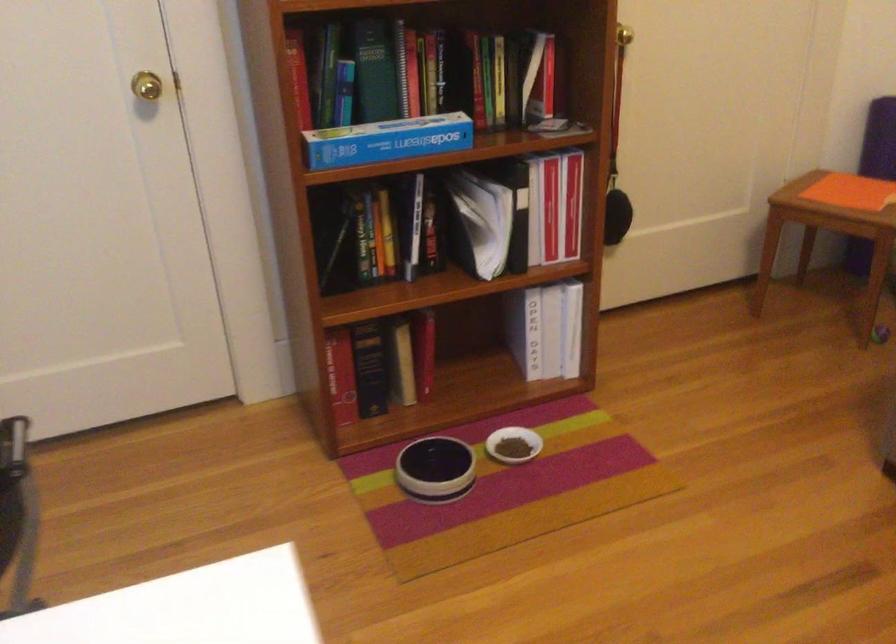
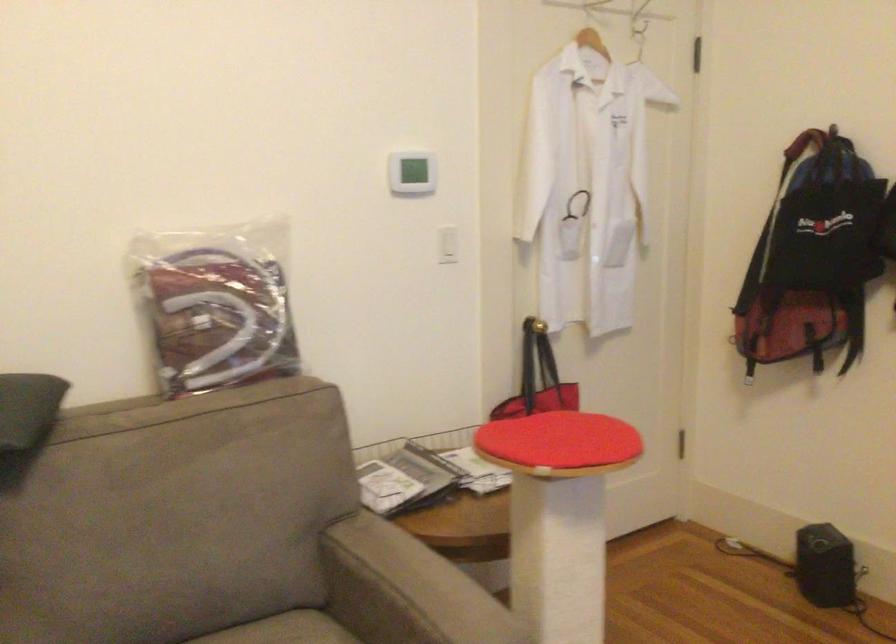
Question: The camera is either moving clockwise (left) or counter-clockwise (right) around the object. The first image is from the beginning of the video and the second image is from the end. Is the camera moving left or right when shooting the video?

Choices:
 (A) Left
 (B) Right

Answer: (A)